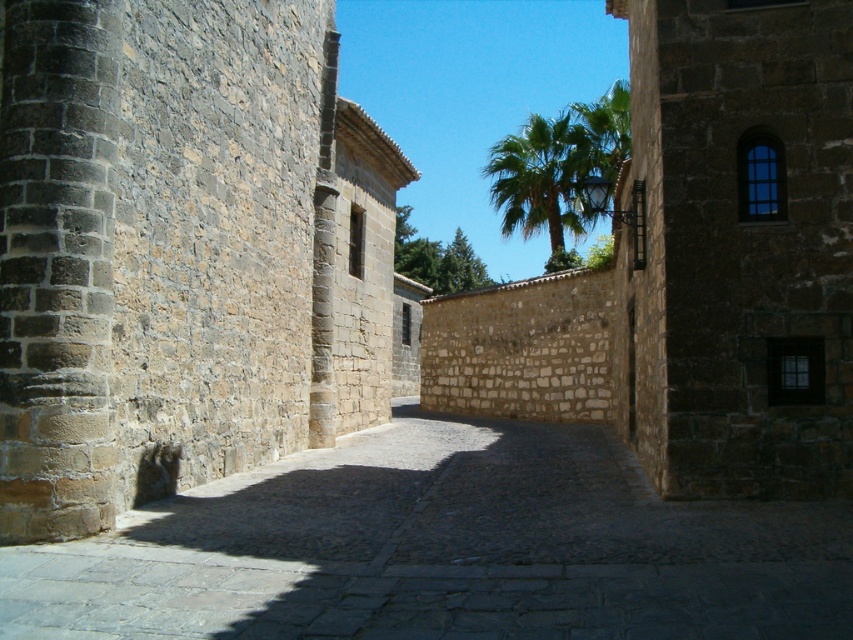
Question: Which point is farther to the camera?

Choices:
 (A) (477, 497)
 (B) (578, 218)

Answer: (B)

Question: Is dark stone path at center wider than green leafy palm at upper center?

Choices:
 (A) no
 (B) yes

Answer: (A)

Question: Which point is closer to the camera taking this photo?

Choices:
 (A) (520, 168)
 (B) (817, 605)

Answer: (B)

Question: Is dark stone path at center bigger than green leafy palm at upper center?

Choices:
 (A) yes
 (B) no

Answer: (B)

Question: Can you confirm if dark stone path at center is positioned to the right of green leafy palm at upper center?

Choices:
 (A) yes
 (B) no

Answer: (B)